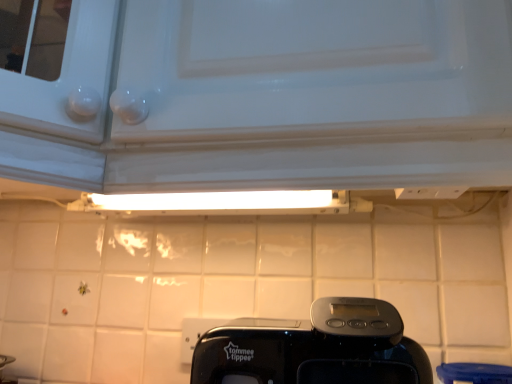
This screenshot has height=384, width=512. Describe the element at coordinates (23, 348) in the screenshot. I see `white glossy tile at lower left` at that location.

Locate an element on the screen. This screenshot has width=512, height=384. white glossy tile at lower left is located at coordinates (23, 348).

Measure the distance between point [30,352] and camera.

35.28 inches.

Where is `black plastic toaster at center`? The width and height of the screenshot is (512, 384). black plastic toaster at center is located at coordinates (314, 348).

What do you see at coordinates (314, 348) in the screenshot?
I see `black plastic toaster at center` at bounding box center [314, 348].

Image resolution: width=512 pixels, height=384 pixels. Find the location of `white glossy tile at lower left`. white glossy tile at lower left is located at coordinates (23, 348).

Visually, is white glossy tile at lower left positioned to the left or to the right of black plastic toaster at center?

From the image, it's evident that white glossy tile at lower left is to the left of black plastic toaster at center.

Is white glossy tile at lower left closer to the viewer compared to black plastic toaster at center?

No.

Which point is more forward, [38,376] or [335,368]?

The point [335,368] is closer.

From the image's perspective, relative to black plastic toaster at center, is white glossy tile at lower left above or below?

Clearly, from the image's perspective, white glossy tile at lower left is below black plastic toaster at center.

From a real-world perspective, who is located lower, white glossy tile at lower left or black plastic toaster at center?

white glossy tile at lower left, from a real-world perspective.

Considering the relative sizes of white glossy tile at lower left and black plastic toaster at center in the image provided, is white glossy tile at lower left wider than black plastic toaster at center?

In fact, white glossy tile at lower left might be narrower than black plastic toaster at center.

Can you confirm if white glossy tile at lower left is shorter than black plastic toaster at center?

No, white glossy tile at lower left is not shorter than black plastic toaster at center.

Does white glossy tile at lower left have a larger size compared to black plastic toaster at center?

Incorrect, white glossy tile at lower left is not larger than black plastic toaster at center.

Can black plastic toaster at center be found inside white glossy tile at lower left?

No, black plastic toaster at center is located outside of white glossy tile at lower left.

Is white glossy tile at lower left positioned far away from black plastic toaster at center?

No.

Is white glossy tile at lower left facing towards black plastic toaster at center?

No, white glossy tile at lower left is not facing towards black plastic toaster at center.

How different are the orientations of white glossy tile at lower left and black plastic toaster at center in degrees?

0.00031 degrees separate the facing orientations of white glossy tile at lower left and black plastic toaster at center.

How far apart are white glossy tile at lower left and black plastic toaster at center?

white glossy tile at lower left is 21.80 inches from black plastic toaster at center.

This screenshot has width=512, height=384. What are the coordinates of `tile lying on the left of black plastic toaster at center` in the screenshot? It's located at (23, 348).

Which is more to the right, black plastic toaster at center or white glossy tile at lower left?

black plastic toaster at center.

Is black plastic toaster at center further to the viewer compared to white glossy tile at lower left?

No.

Considering the positions of points (377, 379) and (7, 330), is point (377, 379) farther from camera compared to point (7, 330)?

That is False.

From the image's perspective, is black plastic toaster at center located above or below white glossy tile at lower left?

Clearly, from the image's perspective, black plastic toaster at center is above white glossy tile at lower left.

From a real-world perspective, between black plastic toaster at center and white glossy tile at lower left, who is vertically lower?

From a 3D spatial view, white glossy tile at lower left is below.

Considering the relative sizes of black plastic toaster at center and white glossy tile at lower left in the image provided, is black plastic toaster at center wider than white glossy tile at lower left?

Correct, the width of black plastic toaster at center exceeds that of white glossy tile at lower left.

Can you confirm if black plastic toaster at center is taller than white glossy tile at lower left?

Incorrect, the height of black plastic toaster at center is not larger of that of white glossy tile at lower left.

Based on their sizes in the image, would you say black plastic toaster at center is bigger or smaller than white glossy tile at lower left?

black plastic toaster at center is bigger than white glossy tile at lower left.

Is black plastic toaster at center spatially inside white glossy tile at lower left, or outside of it?

black plastic toaster at center lies outside white glossy tile at lower left.

Looking at this image, would you say black plastic toaster at center is a long distance from white glossy tile at lower left?

They are positioned close to each other.

Is black plastic toaster at center facing away from white glossy tile at lower left?

No, black plastic toaster at center is not facing away from white glossy tile at lower left.

In the scene shown: How many degrees apart are the facing directions of black plastic toaster at center and white glossy tile at lower left?

There is a 0.00031-degree angle between the facing directions of black plastic toaster at center and white glossy tile at lower left.

Measure the distance between black plastic toaster at center and white glossy tile at lower left.

black plastic toaster at center is 21.80 inches from white glossy tile at lower left.

Find the location of `tile behind the black plastic toaster at center`. tile behind the black plastic toaster at center is located at coordinates (23, 348).

You are a GUI agent. You are given a task and a screenshot of the screen. Output one action in this format:
    pyautogui.click(x=<x>, y=<y>)
    Task: Click on the home appliance that appears above the white glossy tile at lower left (from the image's perspective)
    Image resolution: width=512 pixels, height=384 pixels.
    Given the screenshot: What is the action you would take?
    pyautogui.click(x=314, y=348)

Find the location of a particular element. home appliance lying in front of the white glossy tile at lower left is located at coordinates (314, 348).